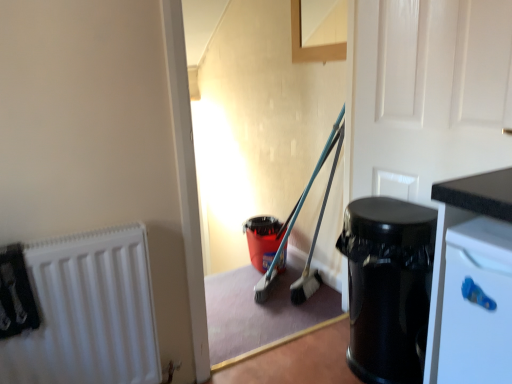
Question: Is black glossy trash can at right taller or shorter than white glossy door at upper right?

Choices:
 (A) tall
 (B) short

Answer: (B)

Question: Considering the positions of point (350, 367) and point (385, 135), is point (350, 367) closer or farther from the camera than point (385, 135)?

Choices:
 (A) farther
 (B) closer

Answer: (A)

Question: Estimate the real-world distances between objects in this image. Which object is farther from the white glossy door at upper right?

Choices:
 (A) black glossy trash can at right
 (B) white matte radiator at left

Answer: (B)

Question: Based on their relative distances, which object is farther from the white matte radiator at left?

Choices:
 (A) white glossy door at upper right
 (B) black glossy trash can at right

Answer: (A)